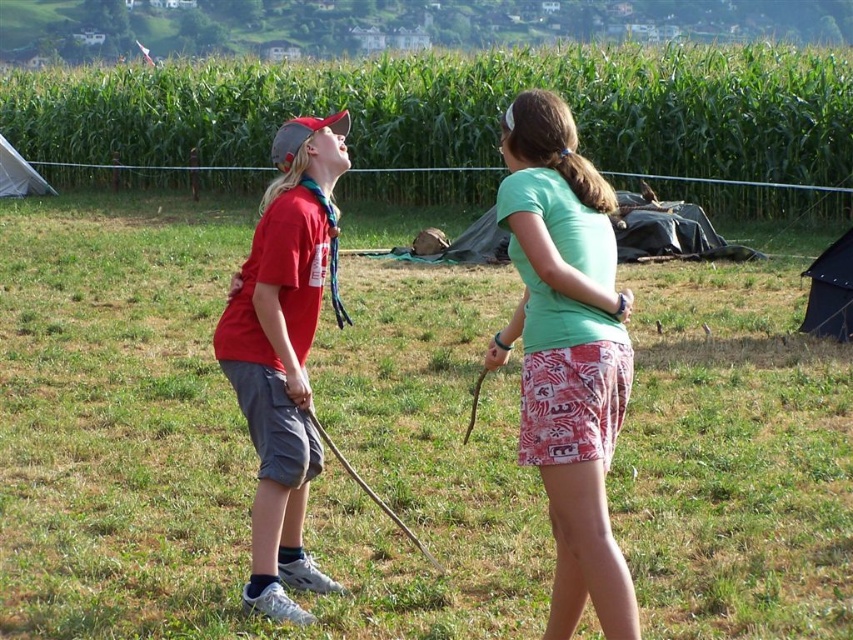
Consider the image. Who is more distant from viewer, (529, 284) or (244, 380)?

The point (244, 380) is more distant.

Between green fabric shirt at center and matte red shirt at left, which one is positioned higher?

green fabric shirt at center

Who is more forward, (598,340) or (242,392)?

Point (598,340) is in front.

This screenshot has height=640, width=853. I want to click on green fabric shirt at center, so click(x=567, y=353).

Does green fabric shorts at center have a greater height compared to green leafy corn at upper center?

No, green fabric shorts at center is not taller than green leafy corn at upper center.

Between green fabric shorts at center and green leafy corn at upper center, which one is positioned higher?

green leafy corn at upper center

Identify the location of green fabric shorts at center. This screenshot has width=853, height=640. (245, 436).

Image resolution: width=853 pixels, height=640 pixels. What do you see at coordinates (459, 112) in the screenshot?
I see `green leafy corn at upper center` at bounding box center [459, 112].

Which is in front, point (126, 141) or point (270, 573)?

Positioned in front is point (270, 573).

Locate an element on the screen. Image resolution: width=853 pixels, height=640 pixels. green leafy corn at upper center is located at coordinates (459, 112).